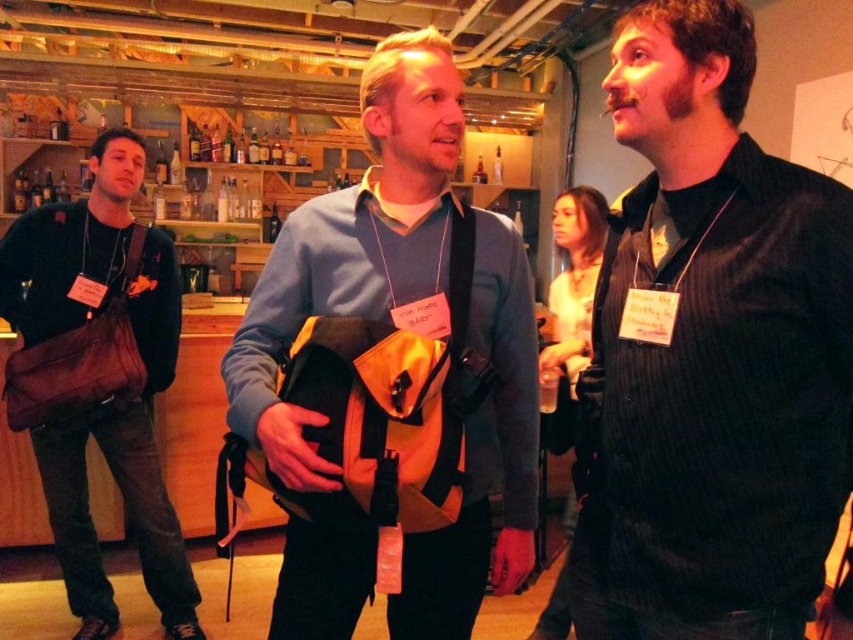
You are organizing a networking event and need to retrieve a bag from the floor. You see the yellow fabric backpack at center and the brown canvas bag at left. Which bag is covering the other one?

The yellow fabric backpack at center is positioned over the brown canvas bag at left, so the yellow one is covering the brown one.

You are standing in the bar and want to hand a drink to the person wearing the black pinstripe shirt at center. If your arm can reach 36 inches, can you reach them without moving?

The black pinstripe shirt at center and viewer are 35.93 inches apart. Since your arm can reach 36 inches, you can just barely reach them without moving.